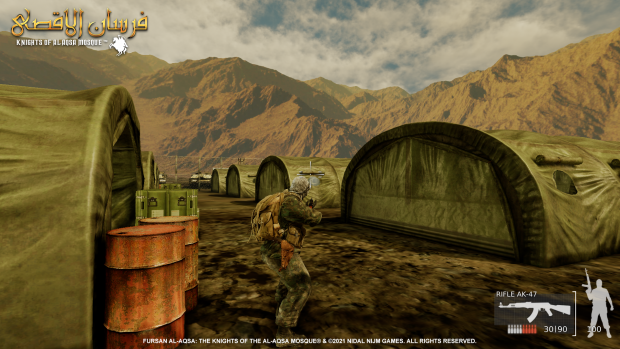
Identify the location of rolled up flap to cover window. (559, 160).